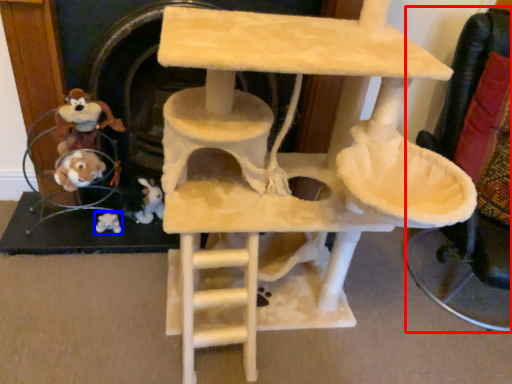
Question: Which of the following is the farthest to the observer, armchair (highlighted by a red box) or toy (highlighted by a blue box)?

Choices:
 (A) armchair
 (B) toy

Answer: (B)